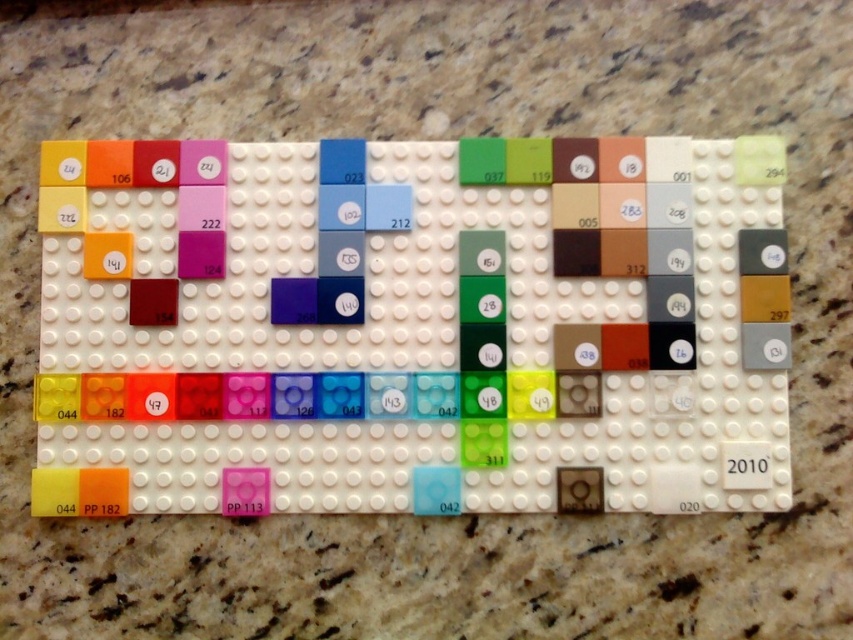
You are building a LEGO structure and need to place a new brick. The matte gray square at right and the matte green square at center are already on the baseplate. Which brick can you place a larger brick on top of without it falling over?

The matte gray square at right has a larger size compared to the matte green square at center, so placing a larger brick on top of the matte gray square at right would be more stable and less likely to fall over.